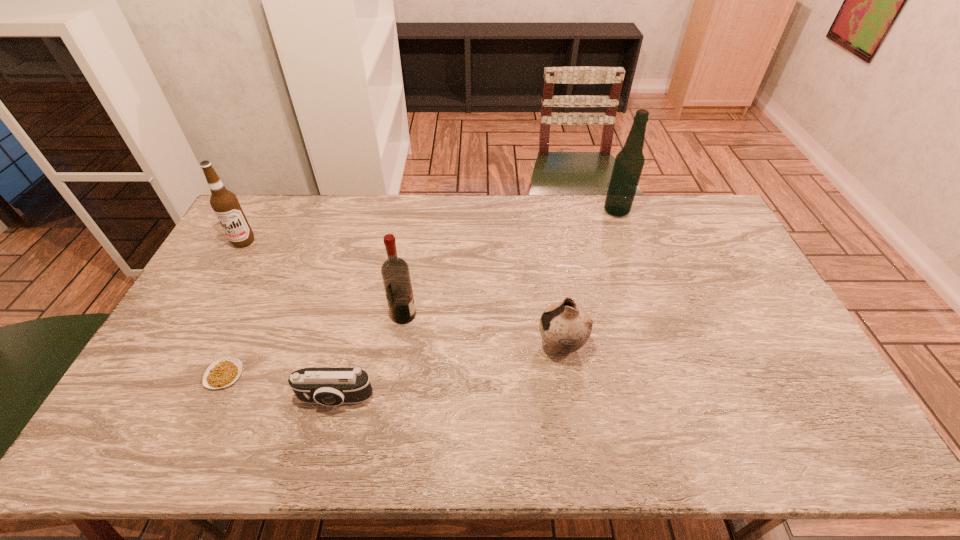
You are a GUI agent. You are given a task and a screenshot of the screen. Output one action in this format:
    pyautogui.click(x=<x>, y=<y>)
    Task: Click on the empty location between the third object from right to left and the farthest alcohol
    The image size is (960, 540).
    Given the screenshot: What is the action you would take?
    coord(510,263)

Locate an element on the screen. The width and height of the screenshot is (960, 540). free space that is in between the pottery and the rightmost object is located at coordinates (588, 278).

The image size is (960, 540). Identify the location of free spot between the shortest object and the tallest alcohol. pyautogui.click(x=420, y=293).

Identify the location of blank region between the nearest alcohol and the leftmost object. The height and width of the screenshot is (540, 960). (324, 278).

The image size is (960, 540). I want to click on vacant space that is in between the third object from left to right and the leftmost object, so click(x=290, y=320).

What are the coordinates of `empty space between the fourth object from left to right and the second object from right to left` in the screenshot? It's located at (483, 330).

Image resolution: width=960 pixels, height=540 pixels. Identify the location of free space between the camera and the second farthest alcohol. (290, 320).

This screenshot has width=960, height=540. What are the coordinates of `empty space that is in between the fourth object from left to right and the pottery` in the screenshot? It's located at (483, 330).

Where is `unoccupied position between the third object from right to left and the fifth object from right to left`? This screenshot has height=540, width=960. unoccupied position between the third object from right to left and the fifth object from right to left is located at coordinates (314, 345).

The width and height of the screenshot is (960, 540). Identify the location of object identified as the third closest to the second shortest object. (565, 327).